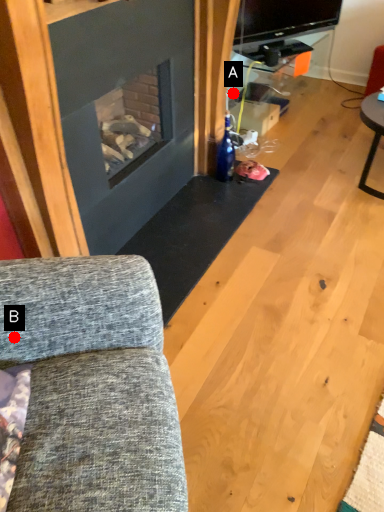
Question: Two points are circled on the image, labeled by A and B beside each circle. Which point is farther to the camera?

Choices:
 (A) A is further
 (B) B is further

Answer: (A)